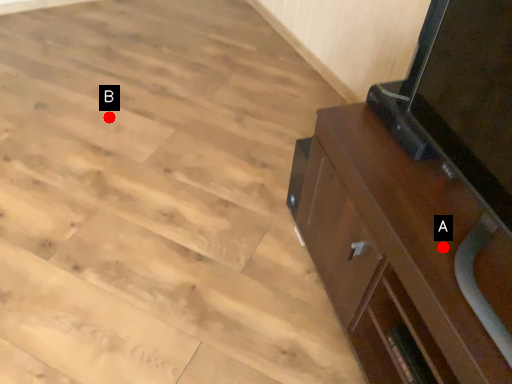
Question: Two points are circled on the image, labeled by A and B beside each circle. Which of the following is the closest to the observer?

Choices:
 (A) A is closer
 (B) B is closer

Answer: (A)